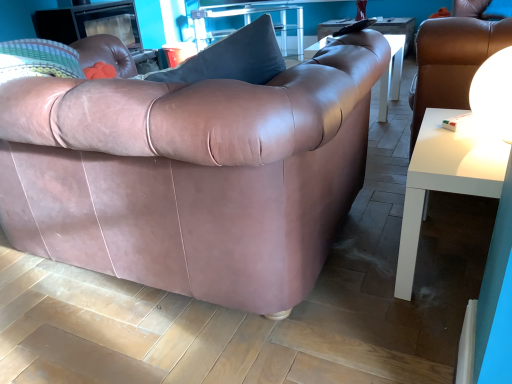
The width and height of the screenshot is (512, 384). Identify the location of free space behind white glossy table at lower right, which appears as the 1th table when viewed from the front. (393, 207).